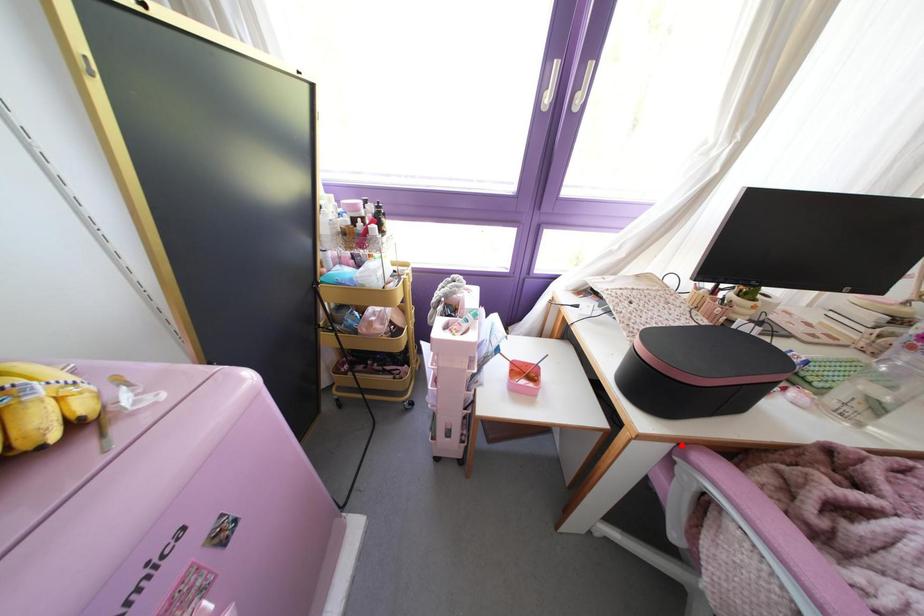
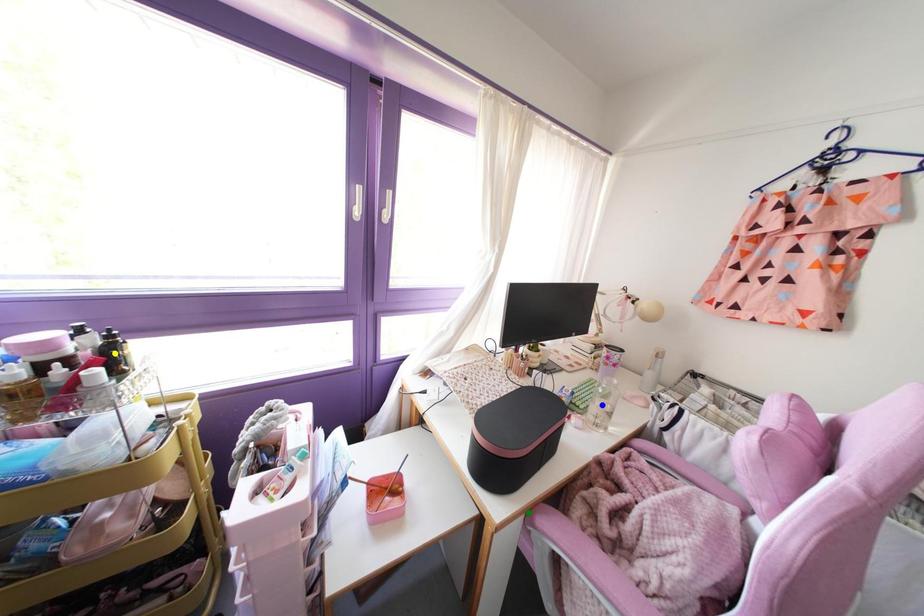
Question: I am providing you with two images of the same scene from different viewpoints. A red point is marked on the first image. You are given multiple points on the second image. Which spot in image 2 lines up with the point in image 1?

Choices:
 (A) green point
 (B) yellow point
 (C) blue point

Answer: (A)